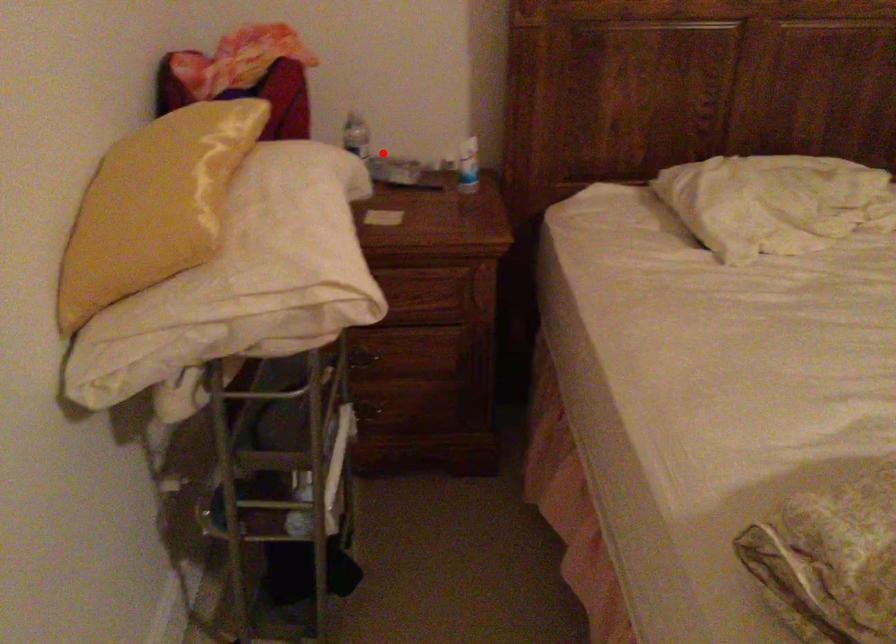
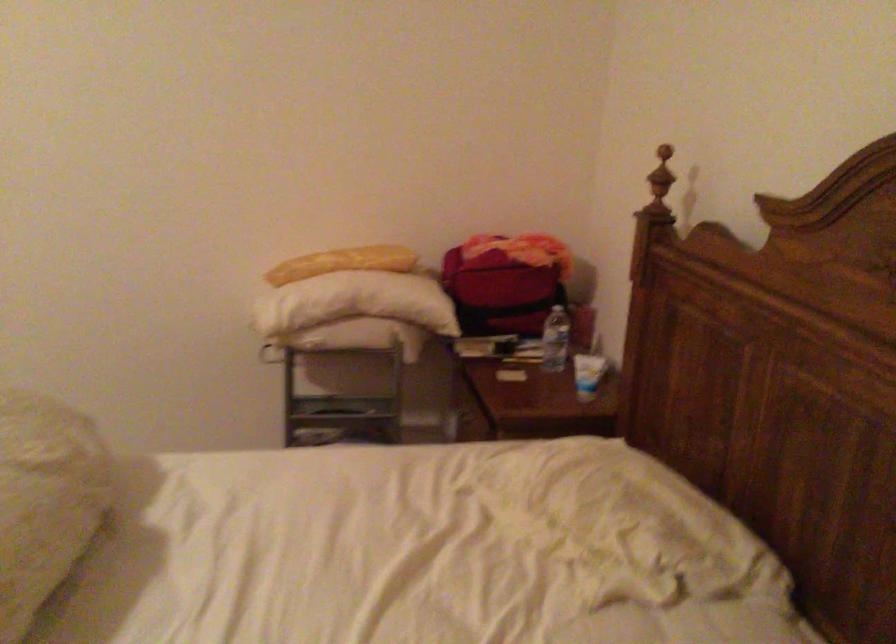
Question: I am providing you with two images of the same scene from different viewpoints. Given a red point in image1, look at the same physical point in image2. Is it:

Choices:
 (A) Closer to the viewpoint
 (B) Farther from the viewpoint

Answer: (B)